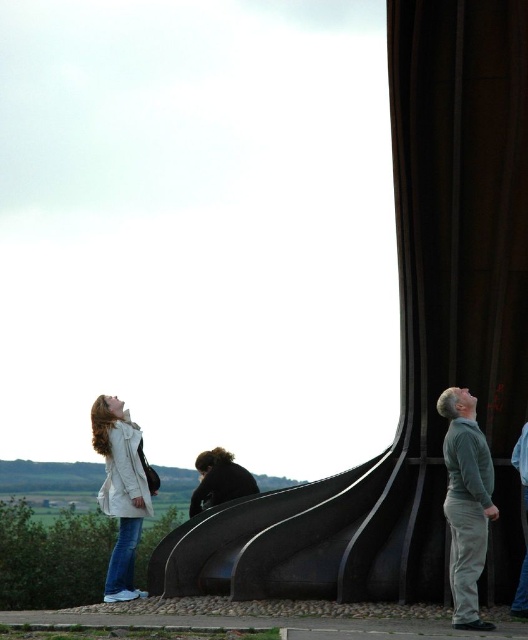
Question: Which object appears closest to the camera in this image?

Choices:
 (A) white matte jacket at lower left
 (B) black matte curtain at right
 (C) gray-green fleece jacket at right

Answer: (C)

Question: Does black matte curtain at right appear on the right side of white matte jacket at lower left?

Choices:
 (A) no
 (B) yes

Answer: (B)

Question: Which point is farther to the camera?

Choices:
 (A) (117, 500)
 (B) (473, 339)

Answer: (A)

Question: Which object appears closest to the camera in this image?

Choices:
 (A) white matte jacket at lower left
 (B) gray-green fleece jacket at right
 (C) black matte curtain at right

Answer: (B)

Question: Can you confirm if black matte curtain at right is positioned to the right of white matte jacket at lower left?

Choices:
 (A) yes
 (B) no

Answer: (A)

Question: Considering the relative positions of gray-green fleece jacket at right and white matte jacket at lower left in the image provided, where is gray-green fleece jacket at right located with respect to white matte jacket at lower left?

Choices:
 (A) left
 (B) right

Answer: (B)